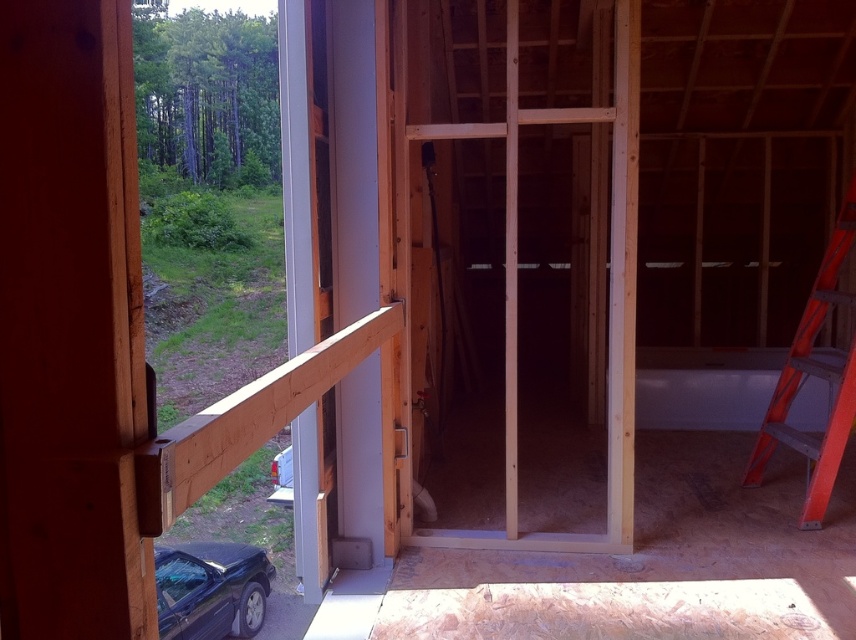
Question: Which object is closer to the camera taking this photo?

Choices:
 (A) orange plastic ladder at right
 (B) natural wood beam at left

Answer: (B)

Question: Can you confirm if natural wood beam at left is positioned to the right of orange plastic ladder at right?

Choices:
 (A) yes
 (B) no

Answer: (B)

Question: Which object appears farthest from the camera in this image?

Choices:
 (A) natural wood beam at left
 (B) orange plastic ladder at right

Answer: (B)

Question: Among these points, which one is nearest to the camera?

Choices:
 (A) (242, 456)
 (B) (821, 358)

Answer: (A)

Question: Is natural wood beam at left thinner than orange plastic ladder at right?

Choices:
 (A) no
 (B) yes

Answer: (B)

Question: Can you confirm if natural wood beam at left is bigger than orange plastic ladder at right?

Choices:
 (A) no
 (B) yes

Answer: (A)